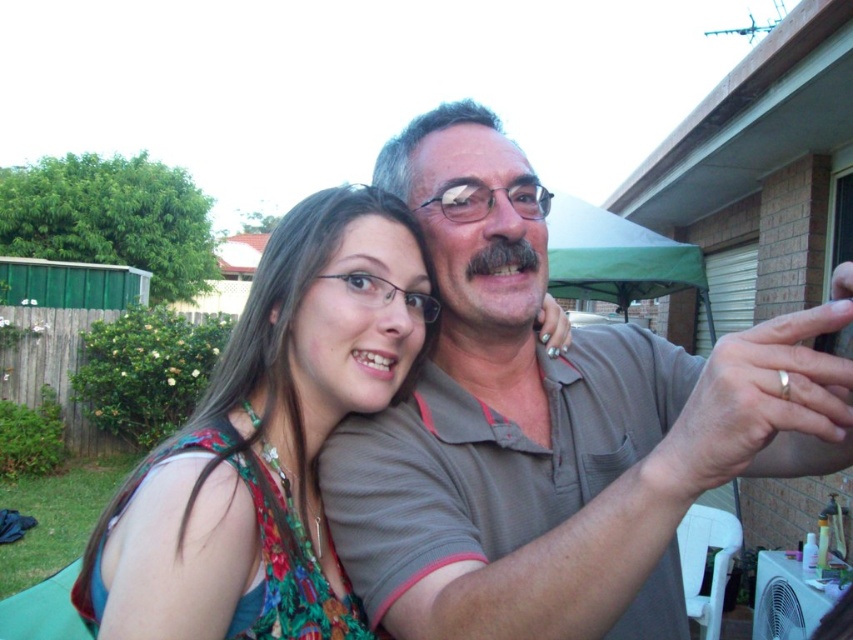
You are standing in the backyard and want to place a small potted plant between the two points, point (621, 600) and point (202, 602). Which point should the plant be closer to if you want it to be closer to the front of the backyard?

The plant should be placed closer to point (621, 600) because it is in front of point (202, 602).

You are a photographer trying to capture a portrait of both the gray cotton shirt at center and the floral fabric dress at center. Which clothing item should you focus on first if you want to ensure both are in sharp focus?

The gray cotton shirt at center is below the floral fabric dress at center, so you should focus on the gray cotton shirt at center first to ensure both are in sharp focus.